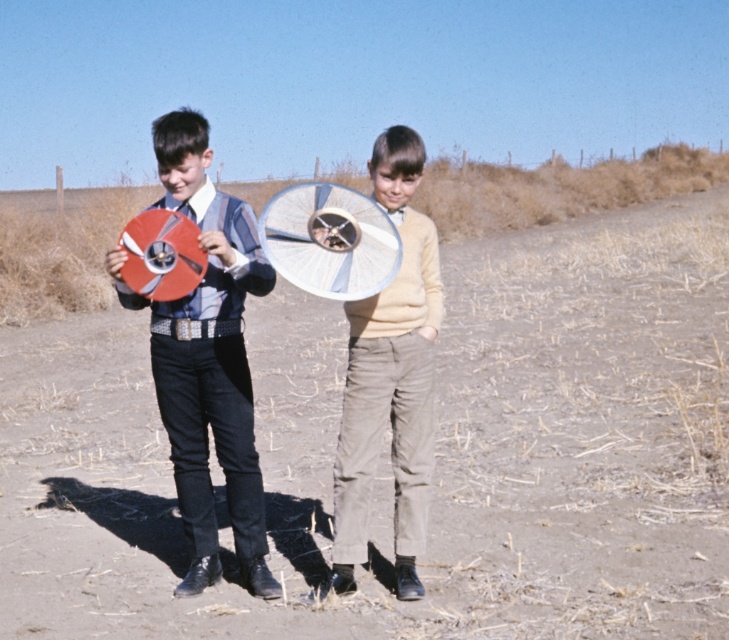
You are trying to decide which object is wider between the matte plastic disc at left and the light beige corduroy pants at center. Based on the scene, which one is wider?

The matte plastic disc at left is wider than the light beige corduroy pants at center.

You are a gardener who needs to plant a small tree. The tree requires a planting hole deeper than the depth of the matte plastic disc at left. Can you use the dull brown dirt at center for this purpose?

The dull brown dirt at center has a greater height compared to the matte plastic disc at left, so yes, the dull brown dirt at center can be used to plant the tree since its height is sufficient to accommodate the required depth.